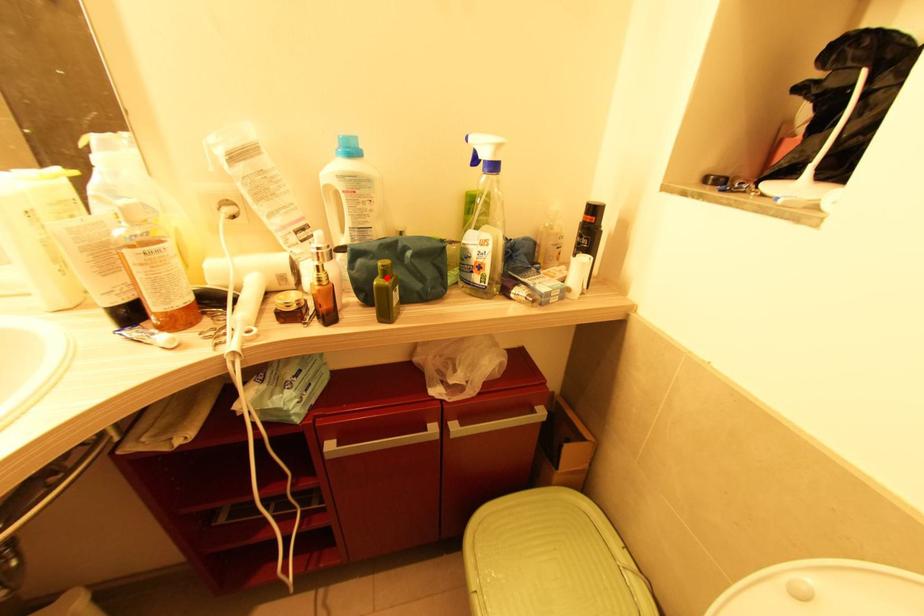
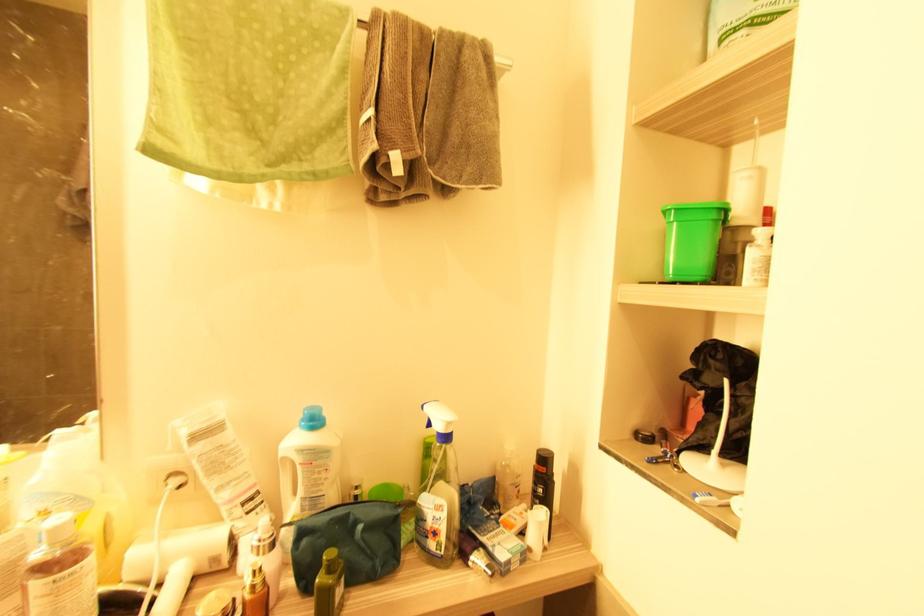
Question: I am providing you with two images of the same scene from different viewpoints. A red point is marked on the first image. At the location where the point appears in image 1, is it still visible in image 2?

Choices:
 (A) Yes
 (B) No

Answer: (A)